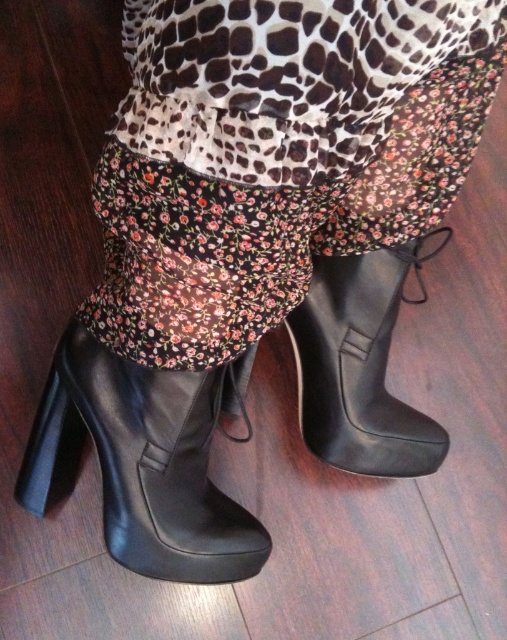
Does floral fabric skirt at center have a lesser width compared to black leather boot at lower left?

Incorrect, floral fabric skirt at center's width is not less than black leather boot at lower left's.

Can you confirm if floral fabric skirt at center is positioned to the right of black leather boot at lower left?

Yes, floral fabric skirt at center is to the right of black leather boot at lower left.

The width and height of the screenshot is (507, 640). Describe the element at coordinates (275, 156) in the screenshot. I see `floral fabric skirt at center` at that location.

Locate an element on the screen. The width and height of the screenshot is (507, 640). floral fabric skirt at center is located at coordinates (275, 156).

Is black leather boot at lower left to the left of black leather boot at lower center from the viewer's perspective?

Correct, you'll find black leather boot at lower left to the left of black leather boot at lower center.

Is point (218, 396) positioned behind point (421, 460)?

No, (218, 396) is closer to viewer.

Who is more distant from viewer, (28, 465) or (396, 433)?

Point (396, 433)

In order to click on black leather boot at lower left in this screenshot , I will do `click(140, 464)`.

Between floral fabric skirt at center and black leather boot at lower center, which one has more height?

floral fabric skirt at center

Who is more forward, (312,193) or (399,474)?

Point (312,193)

Does point (464, 122) come behind point (388, 298)?

No, it is not.

At what (x,y) coordinates should I click in order to perform the action: click on floral fabric skirt at center. Please return your answer as a coordinate pair (x, y). The height and width of the screenshot is (640, 507). Looking at the image, I should click on (275, 156).